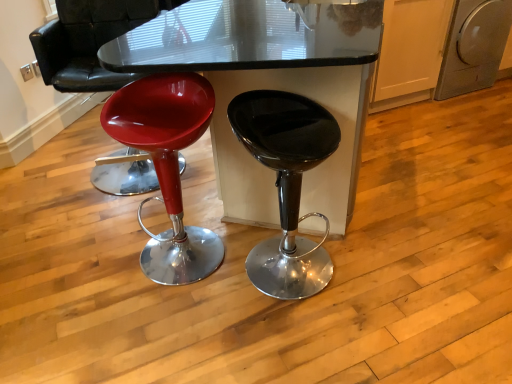
The image size is (512, 384). In order to click on vacant space in between glossy black stool at center, arranged as the 2th stool when viewed from the left, and glossy plastic stool at left, which is the 2th stool in right-to-left order in this screenshot , I will do `click(231, 264)`.